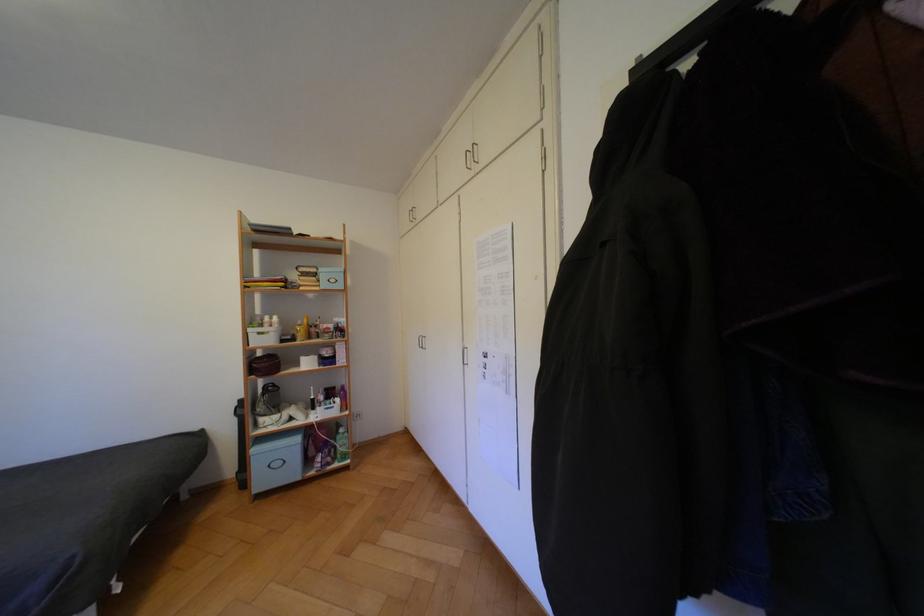
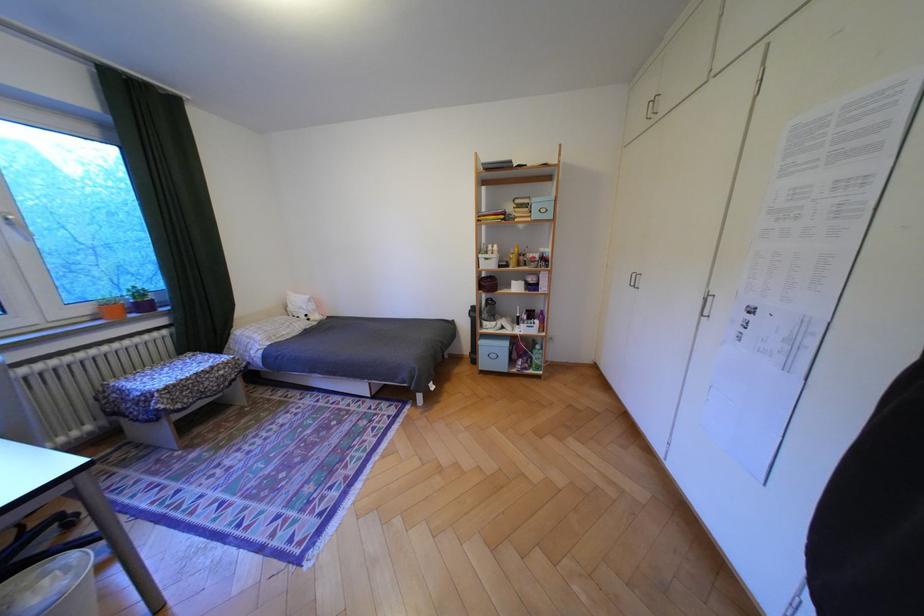
In the second image, find the point that corresponds to [261,283] in the first image.

(492, 217)